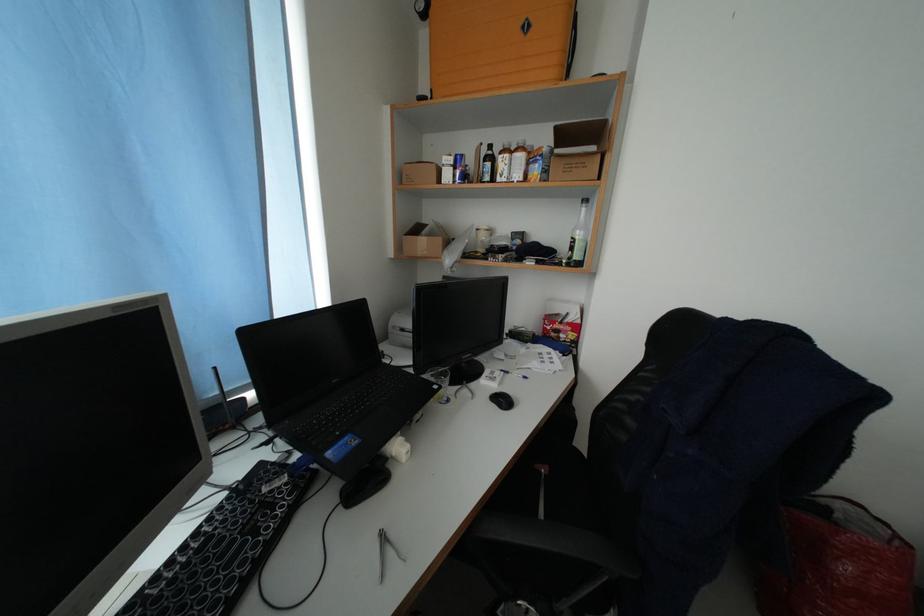
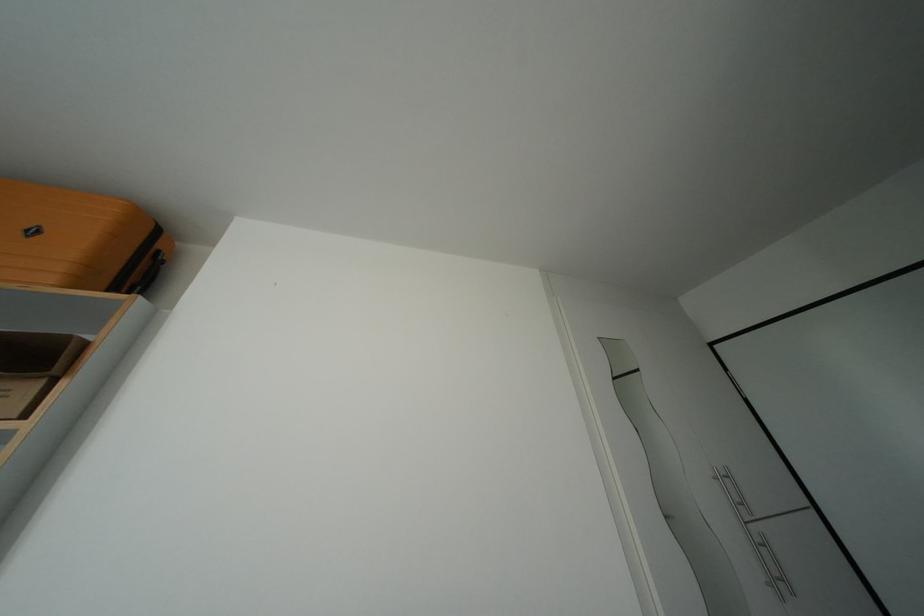
The images are taken continuously from a first-person perspective. In which direction is your viewpoint rotating?

The camera's rotation is toward right-up.